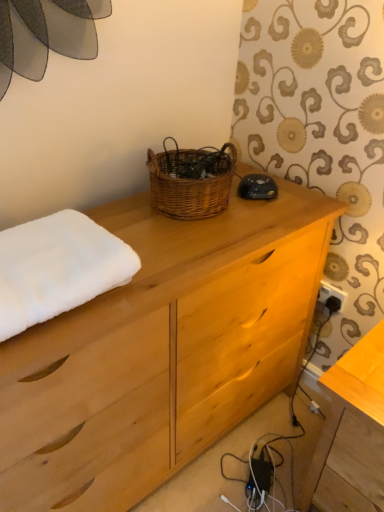
Question: From a real-world perspective, is wooden table at lower right under natural wood chest of drawers at center?

Choices:
 (A) yes
 (B) no

Answer: (A)

Question: Is wooden table at lower right at the right side of natural wood chest of drawers at center?

Choices:
 (A) yes
 (B) no

Answer: (A)

Question: Would you say wooden table at lower right contains natural wood chest of drawers at center?

Choices:
 (A) yes
 (B) no

Answer: (B)

Question: From a real-world perspective, is wooden table at lower right physically above natural wood chest of drawers at center?

Choices:
 (A) no
 (B) yes

Answer: (A)

Question: Is wooden table at lower right turned away from natural wood chest of drawers at center?

Choices:
 (A) no
 (B) yes

Answer: (A)

Question: Is wooden table at lower right completely or partially outside of natural wood chest of drawers at center?

Choices:
 (A) yes
 (B) no

Answer: (A)

Question: Is wooden table at lower right thinner than woven brown basket at center?

Choices:
 (A) yes
 (B) no

Answer: (B)

Question: Is wooden table at lower right to the right of woven brown basket at center from the viewer's perspective?

Choices:
 (A) yes
 (B) no

Answer: (A)

Question: Can you see wooden table at lower right touching woven brown basket at center?

Choices:
 (A) no
 (B) yes

Answer: (A)

Question: Is wooden table at lower right positioned with its back to woven brown basket at center?

Choices:
 (A) yes
 (B) no

Answer: (B)

Question: Is woven brown basket at center completely or partially inside wooden table at lower right?

Choices:
 (A) yes
 (B) no

Answer: (B)

Question: Is wooden table at lower right further to camera compared to woven brown basket at center?

Choices:
 (A) yes
 (B) no

Answer: (B)

Question: Is woven brown basket at center aimed at wooden table at lower right?

Choices:
 (A) no
 (B) yes

Answer: (A)